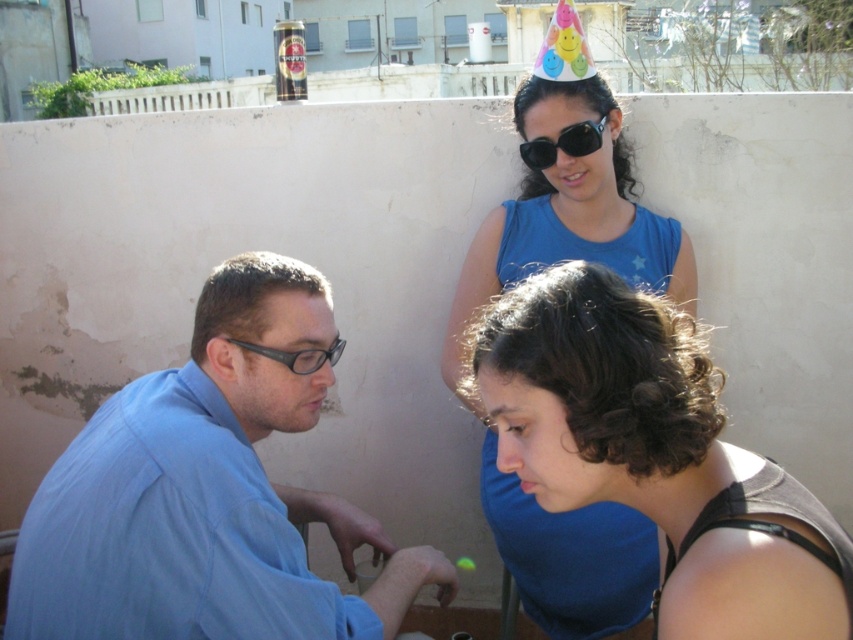
Question: Which of the following is the closest to the observer?

Choices:
 (A) dark brown curly hair at lower right
 (B) blue shirt at left
 (C) black matte sunglasses at upper center
 (D) blue fabric dress at upper center

Answer: (A)

Question: Can you confirm if blue shirt at left is positioned to the right of matte black glasses at left?

Choices:
 (A) no
 (B) yes

Answer: (A)

Question: Is blue fabric dress at upper center below black matte sunglasses at upper center?

Choices:
 (A) no
 (B) yes

Answer: (B)

Question: Which point is farther from the camera taking this photo?

Choices:
 (A) 281,424
 (B) 567,154
 (C) 519,134
 (D) 329,346

Answer: (C)

Question: Estimate the real-world distances between objects in this image. Which object is closer to the black matte sunglasses at upper center?

Choices:
 (A) matte black glasses at left
 (B) blue shirt at left
 (C) blue fabric dress at upper center

Answer: (C)

Question: Does blue shirt at left come in front of dark brown curly hair at lower right?

Choices:
 (A) yes
 (B) no

Answer: (B)